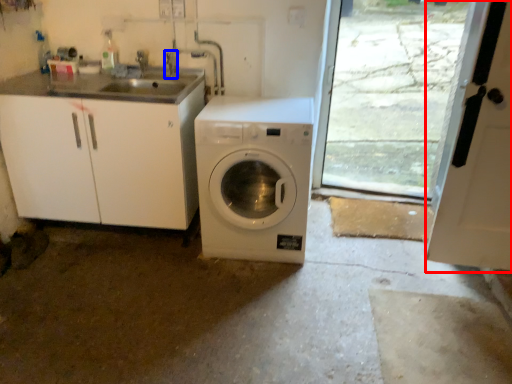
Question: Which of the following is the closest to the observer, screen door (highlighted by a red box) or faucet (highlighted by a blue box)?

Choices:
 (A) screen door
 (B) faucet

Answer: (A)